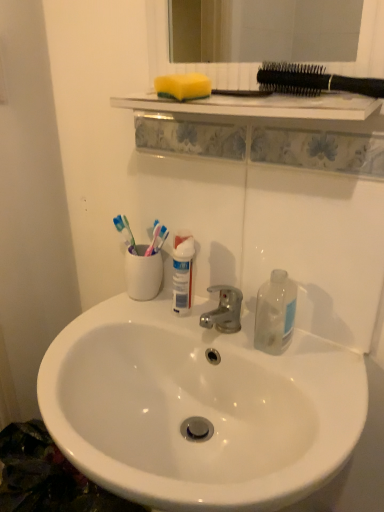
The image size is (384, 512). Identify the location of vacant space positioned to the left of transparent plastic bottle at right. (199, 325).